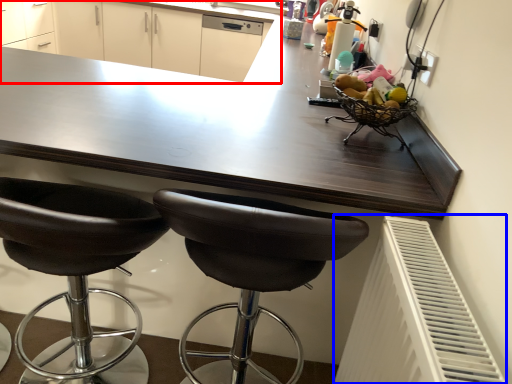
Question: Among these objects, which one is farthest to the camera, cabinetry (highlighted by a red box) or radiator (highlighted by a blue box)?

Choices:
 (A) cabinetry
 (B) radiator

Answer: (A)